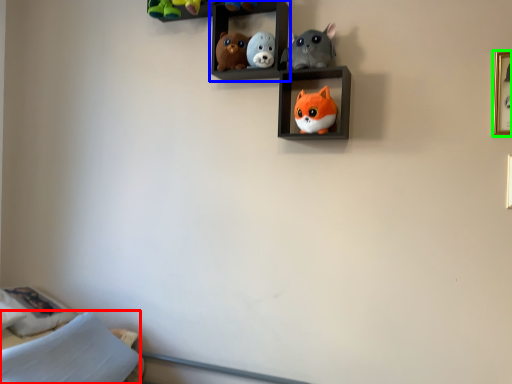
Question: Which object is the farthest from pillow (highlighted by a red box)? Choose among these: shelf (highlighted by a blue box) or picture frame (highlighted by a green box).

Choices:
 (A) shelf
 (B) picture frame

Answer: (B)